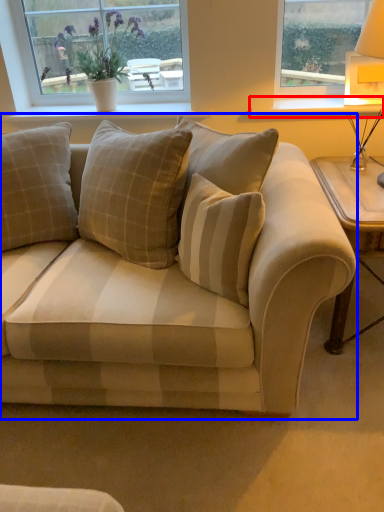
Question: Which of the following is the farthest to the observer, window sill (highlighted by a red box) or studio couch (highlighted by a blue box)?

Choices:
 (A) window sill
 (B) studio couch

Answer: (A)